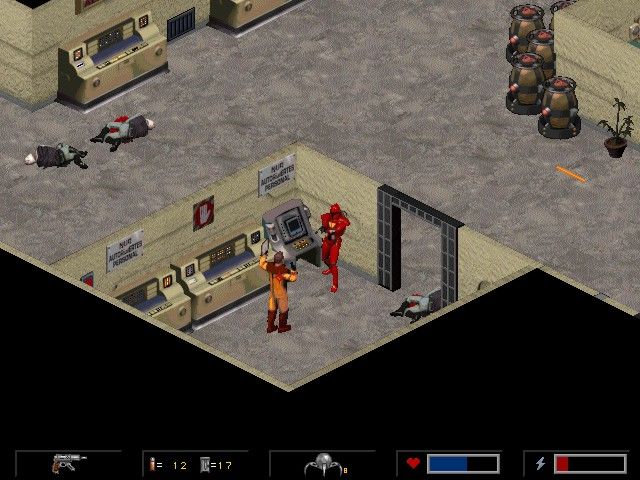
You are a GUI agent. You are given a task and a screenshot of the screen. Output one action in this format:
    pyautogui.click(x=<x>, y=<y>)
    Task: Click on the black tiled entryway
    
    Given the screenshot: What is the action you would take?
    pyautogui.click(x=385, y=240)